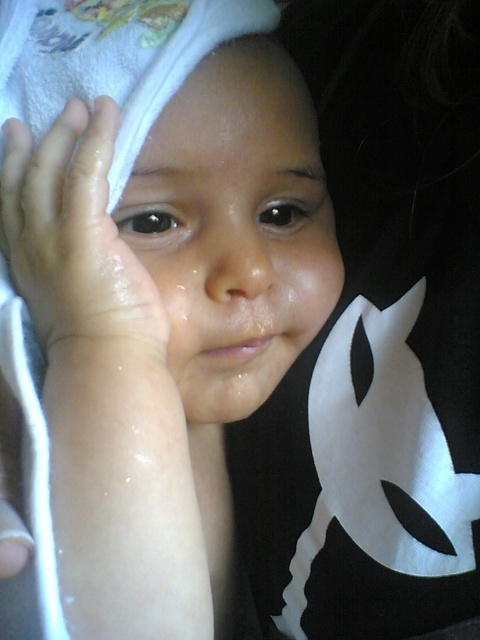
You are a caregiver checking the distance between the white towel at upper left and the smooth skin face at center to ensure safety. Is the distance less than 2 inches?

The distance between the white towel at upper left and the smooth skin face at center is 1.52 inches, which is less than 2 inches, so the distance is safe.

You are a caregiver trying to dry the child after a bath. The white towel at upper left and the smooth skin face at center are in view. Which object has a greater width?

The white towel at upper left has a greater width than the smooth skin face at center according to the description.